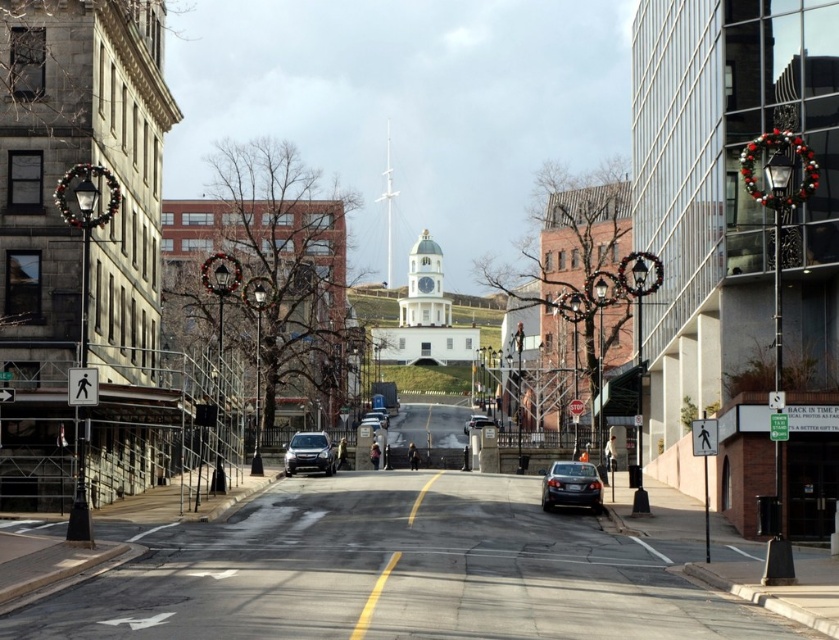
Question: Can you confirm if matte black suv at center is positioned below white glossy spire at center?

Choices:
 (A) no
 (B) yes

Answer: (B)

Question: Which object is positioned farthest from the shiny silver sedan at center?

Choices:
 (A) shiny black sedan at center
 (B) matte black sedan at center

Answer: (A)

Question: Is matte black suv at center bigger than shiny silver sedan at center?

Choices:
 (A) no
 (B) yes

Answer: (A)

Question: Can you confirm if shiny black sedan at center is smaller than matte black suv at center?

Choices:
 (A) no
 (B) yes

Answer: (B)

Question: Which point is farther from the camera taking this photo?

Choices:
 (A) (468, 426)
 (B) (370, 417)
 (C) (592, 483)
 (D) (389, 208)

Answer: (D)

Question: Estimate the real-world distances between objects in this image. Which object is farther from the matte black sedan at center?

Choices:
 (A) matte black suv at center
 (B) shiny black sedan at center

Answer: (B)